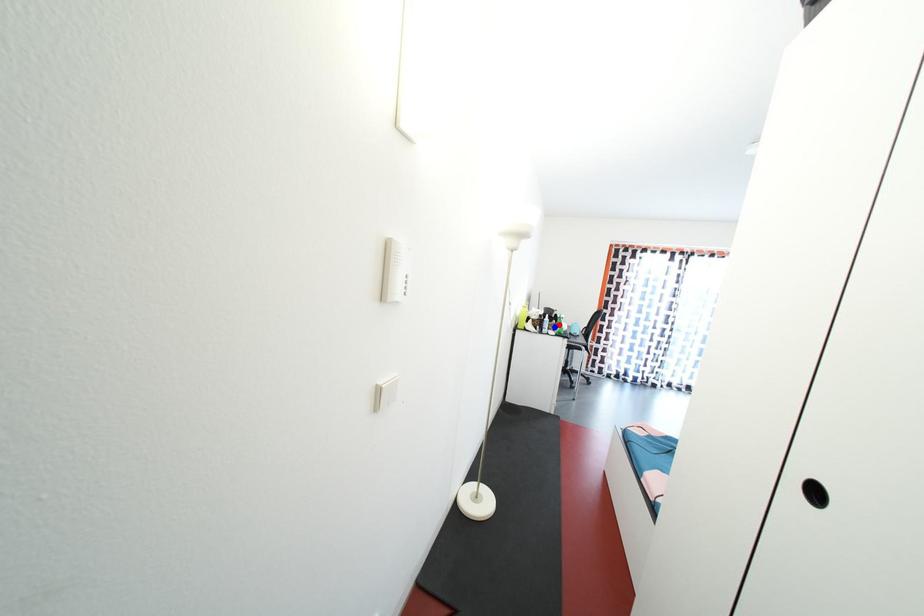
Question: Which of the two points in the image is closer to the camera?

Choices:
 (A) Blue point is closer.
 (B) Red point is closer.

Answer: (B)